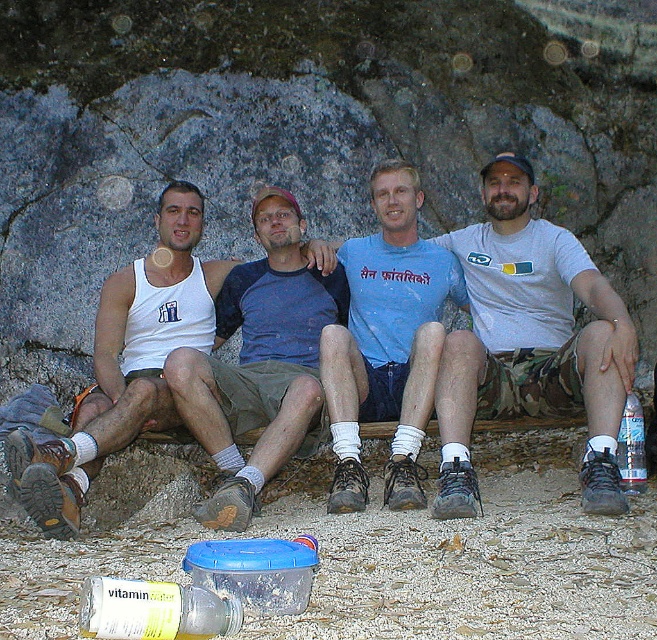
Question: Estimate the real-world distances between objects in this image. Which object is farther from the gray cotton t-shirt at center?

Choices:
 (A) white fabric tank top at center
 (B) clear plastic bottle at lower right
 (C) white cotton tank top at left
 (D) blue cotton shirt at center

Answer: (C)

Question: In this image, where is white fabric tank top at center located relative to clear plastic bottle at lower right?

Choices:
 (A) above
 (B) below

Answer: (A)

Question: Which is farther from the clear plastic bottle at lower right?

Choices:
 (A) white cotton tank top at left
 (B) white fabric tank top at center
 (C) blue cotton shirt at center
 (D) gray cotton t-shirt at center

Answer: (A)

Question: Does gray cotton t-shirt at center appear on the left side of white fabric tank top at center?

Choices:
 (A) no
 (B) yes

Answer: (A)

Question: Is the position of gray cotton t-shirt at center less distant than that of white fabric tank top at center?

Choices:
 (A) no
 (B) yes

Answer: (B)

Question: Which point appears farthest from the camera in this image?

Choices:
 (A) click(332, 269)
 (B) click(81, 620)
 (C) click(618, 464)

Answer: (A)